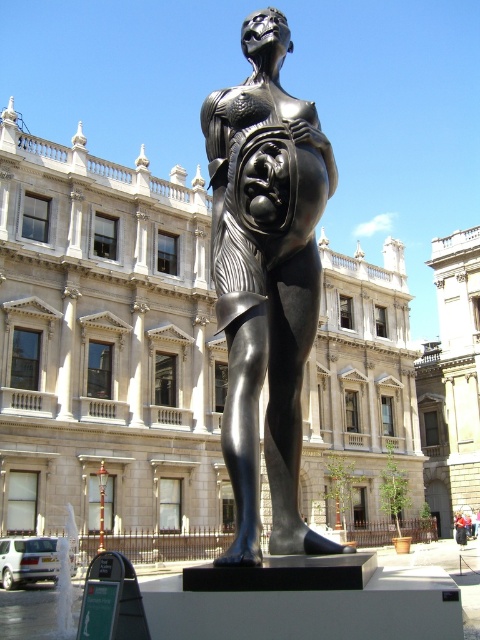
Is black polished statue at center to the left of polished bronze statue at center from the viewer's perspective?

In fact, black polished statue at center is to the right of polished bronze statue at center.

At what (x,y) coordinates should I click in order to perform the action: click on black polished statue at center. Please return your answer as a coordinate pair (x, y). The width and height of the screenshot is (480, 640). Looking at the image, I should click on (107, 342).

Is point (372, 454) positioned in front of point (243, 557)?

No.

This screenshot has width=480, height=640. I want to click on black polished statue at center, so click(107, 342).

Can you confirm if black polished statue at center is taller than dark blue jeans at center?

Correct, black polished statue at center is much taller as dark blue jeans at center.

Is point (152, 333) positioned behind point (456, 520)?

No, it is in front of (456, 520).

You are a GUI agent. You are given a task and a screenshot of the screen. Output one action in this format:
    pyautogui.click(x=<x>, y=<y>)
    Task: Click on the black polished statue at center
    The height and width of the screenshot is (640, 480).
    Given the screenshot: What is the action you would take?
    pyautogui.click(x=107, y=342)

Which of these two, polished bronze statue at center or dark blue jeans at center, stands taller?

polished bronze statue at center

Is polished bronze statue at center smaller than dark blue jeans at center?

Actually, polished bronze statue at center might be larger than dark blue jeans at center.

The image size is (480, 640). Describe the element at coordinates (265, 280) in the screenshot. I see `polished bronze statue at center` at that location.

Where is `polished bronze statue at center`? The height and width of the screenshot is (640, 480). polished bronze statue at center is located at coordinates (265, 280).